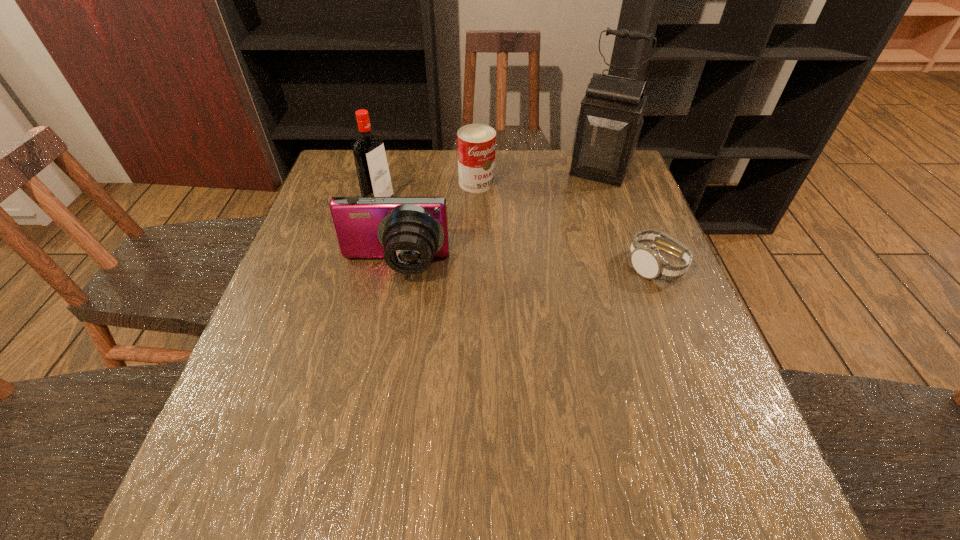
Where is `camera`? Image resolution: width=960 pixels, height=540 pixels. camera is located at coordinates (408, 232).

Where is `watch`? watch is located at coordinates (647, 261).

In order to click on lantern in this screenshot , I will do `click(608, 127)`.

The height and width of the screenshot is (540, 960). What are the coordinates of `the third nearest object` in the screenshot? It's located at (373, 174).

You are a GUI agent. You are given a task and a screenshot of the screen. Output one action in this format:
    pyautogui.click(x=<x>, y=<y>)
    Task: Click on the fourth shortest object
    
    Given the screenshot: What is the action you would take?
    pyautogui.click(x=373, y=174)

At what (x,y) coordinates should I click in order to perform the action: click on the third object from left to right. Please return your answer as a coordinate pair (x, y). Image resolution: width=960 pixels, height=540 pixels. Looking at the image, I should click on (476, 143).

You are a GUI agent. You are given a task and a screenshot of the screen. Output one action in this format:
    pyautogui.click(x=<x>, y=<y>)
    Task: Click on the vacant space located 0.160m on the front-facing side of the camera
    
    Given the screenshot: What is the action you would take?
    pyautogui.click(x=379, y=346)

Where is `vacant point located 0.190m on the face of the shortest object`? vacant point located 0.190m on the face of the shortest object is located at coordinates (689, 356).

Locate an element on the screen. The image size is (960, 540). vacant region located on the front-facing side of the lantern is located at coordinates (563, 245).

The image size is (960, 540). I want to click on vacant region located on the front-facing side of the lantern, so tap(575, 220).